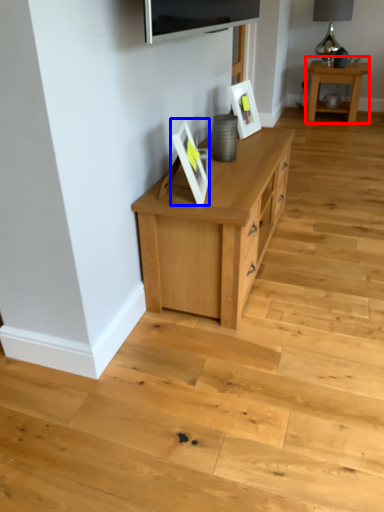
Question: Which point is closer to the camera, table (highlighted by a red box) or picture frame (highlighted by a blue box)?

Choices:
 (A) table
 (B) picture frame

Answer: (B)